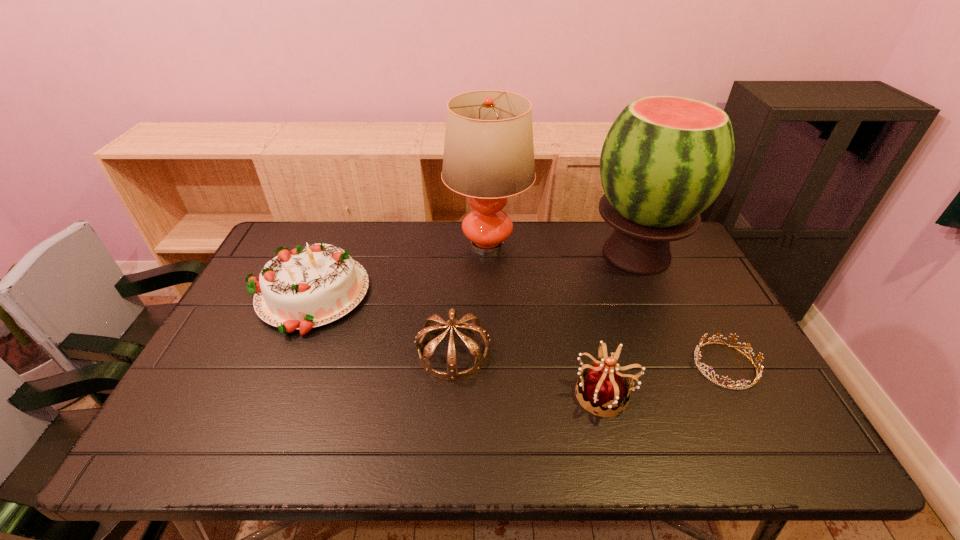
Where is `lamp that is at the far edge`? This screenshot has width=960, height=540. lamp that is at the far edge is located at coordinates (488, 156).

Find the location of a particular element. watermelon that is positioned at the far edge is located at coordinates pyautogui.click(x=665, y=159).

The image size is (960, 540). In order to click on cake present at the far edge in this screenshot , I will do `click(310, 286)`.

The height and width of the screenshot is (540, 960). In order to click on object that is at the near edge in this screenshot , I will do `click(604, 386)`.

Locate an element on the screen. This screenshot has width=960, height=540. object located in the left edge section of the desktop is located at coordinates (310, 286).

Locate an element on the screen. The width and height of the screenshot is (960, 540). watermelon present at the right edge is located at coordinates (665, 159).

Where is `tiara located in the right edge section of the desktop`? The height and width of the screenshot is (540, 960). tiara located in the right edge section of the desktop is located at coordinates 758,375.

Find the location of `object situated at the far left corner`. object situated at the far left corner is located at coordinates (310, 286).

This screenshot has height=540, width=960. I want to click on object that is positioned at the far right corner, so click(x=665, y=159).

At what (x,y) coordinates should I click in order to perform the action: click on free space at the far edge of the desktop. Please return your answer as a coordinate pair (x, y). This screenshot has width=960, height=540. Looking at the image, I should click on click(x=334, y=228).